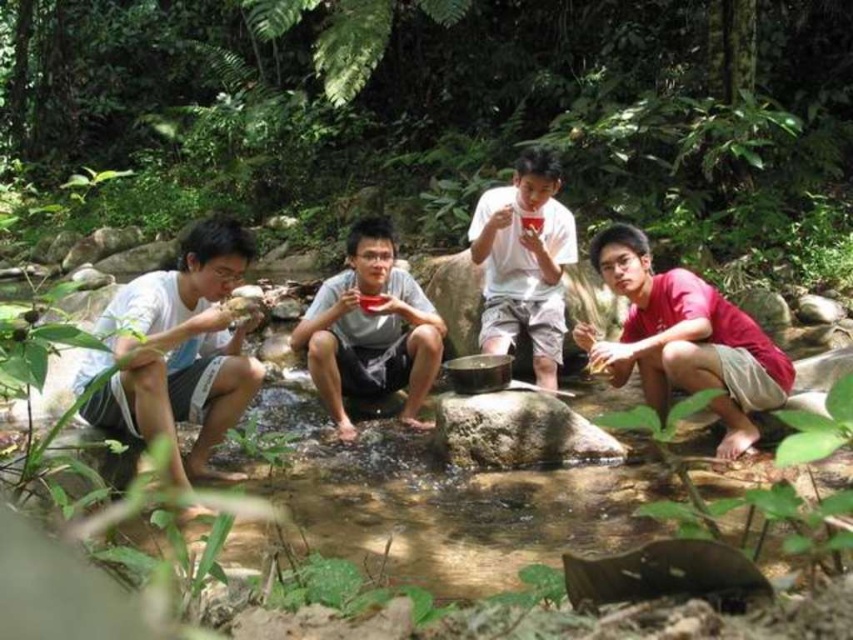
You are planning to serve snacks to your friends at the stream. You have a gray matte bowl at center and a white matte cup at center. Which container can hold more food?

The white matte cup at center can hold more food because it is larger than the gray matte bowl at center.

You are standing at the edge of the creek in the forest scene. There is a point marked at coordinates (459, 509). What is located at that point?

The point at coordinates (459, 509) corresponds to clear water at creek center.

You are planning to take a photo of the white matte cup at center and the green leafy forest at upper center. Which object should you focus on first if you want both to be in sharp focus?

You should focus on the green leafy forest at upper center first because it is much taller than the white matte cup at center, so focusing on the farther object ensures both will be in focus when using a small aperture.